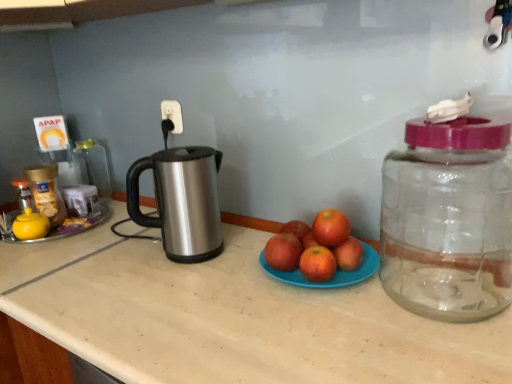
The height and width of the screenshot is (384, 512). What do you see at coordinates (181, 201) in the screenshot? I see `satin silver kettle at left` at bounding box center [181, 201].

In order to face orange matte grapefruit at center, the 1th grapefruit viewed from the top, should I rotate leftwards or rightwards?

To face it directly, rotate right by 9.881 degrees.

In order to click on red matte apple at center, which is the 2th apple from left to right in this screenshot , I will do `click(349, 254)`.

What do you see at coordinates (93, 165) in the screenshot? I see `transparent plastic bottle at left, the 1th bottle when ordered from back to front` at bounding box center [93, 165].

What do you see at coordinates (317, 264) in the screenshot? The width and height of the screenshot is (512, 384). I see `orange matte grapefruit at center, which is the second grapefruit in top-to-bottom order` at bounding box center [317, 264].

Describe the element at coordinates (448, 219) in the screenshot. I see `transparent plastic jar at right, which is the 3th bottle in back-to-front order` at that location.

In order to click on satin silver kettle at left in this screenshot , I will do `click(181, 201)`.

Considering the sizes of beige laminate countertop at center and gold plastic jar at left, the 2th bottle viewed from the back, in the image, is beige laminate countertop at center taller or shorter than gold plastic jar at left, the 2th bottle viewed from the back,?

Clearly, beige laminate countertop at center is taller compared to gold plastic jar at left, the 2th bottle viewed from the back.

Looking at this image, which point is more distant from viewer, (483, 343) or (56, 217)?

The point (56, 217) is farther from the camera.

Is beige laminate countertop at center at the right side of gold plastic jar at left, acting as the 2th bottle starting from the front?

Yes.

Would you say red matte apple at center, which is the 2th apple from left to right, is inside or outside satin silver kettle at left?

red matte apple at center, which is the 2th apple from left to right, is not enclosed by satin silver kettle at left.

Is red matte apple at center, which is the 2th apple from left to right, in front of or behind satin silver kettle at left in the image?

Clearly, red matte apple at center, which is the 2th apple from left to right, is in front of satin silver kettle at left.

Consider the image. Which point is more distant from viewer, (353, 265) or (138, 218)?

The point (138, 218) is more distant.

Visually, is red matte apple at center, acting as the first apple starting from the right, positioned to the left or to the right of satin silver kettle at left?

From the image, it's evident that red matte apple at center, acting as the first apple starting from the right, is to the right of satin silver kettle at left.

Considering the sizes of objects orange matte grapefruit at center, which ranks as the 1th grapefruit in bottom-to-top order, and transparent plastic bottle at left, acting as the second bottle starting from the right, in the image provided, who is smaller, orange matte grapefruit at center, which ranks as the 1th grapefruit in bottom-to-top order, or transparent plastic bottle at left, acting as the second bottle starting from the right,?

→ Smaller between the two is orange matte grapefruit at center, which ranks as the 1th grapefruit in bottom-to-top order.

Are orange matte grapefruit at center, which ranks as the 1th grapefruit in bottom-to-top order, and transparent plastic bottle at left, the 3th bottle viewed from the front, making contact?

No, orange matte grapefruit at center, which ranks as the 1th grapefruit in bottom-to-top order, is not in contact with transparent plastic bottle at left, the 3th bottle viewed from the front.

Based on the photo, in terms of height, does orange matte grapefruit at center, which is the second grapefruit in top-to-bottom order, look taller or shorter compared to transparent plastic bottle at left, which is the 2th bottle from left to right?

Clearly, orange matte grapefruit at center, which is the second grapefruit in top-to-bottom order, is shorter compared to transparent plastic bottle at left, which is the 2th bottle from left to right.

From the image's perspective, starting from the beige laminate countertop at center, which grapefruit is the 1st one above? Please provide its 2D coordinates.

[(317, 264)]

Considering the sizes of objects orange matte grapefruit at center, which is the second grapefruit in top-to-bottom order, and beige laminate countertop at center in the image provided, who is taller, orange matte grapefruit at center, which is the second grapefruit in top-to-bottom order, or beige laminate countertop at center?

Standing taller between the two is beige laminate countertop at center.

Does orange matte grapefruit at center, which ranks as the 1th grapefruit in bottom-to-top order, appear on the right side of beige laminate countertop at center?

Yes.

Looking at this image, is transparent plastic bottle at left, the 3th bottle viewed from the front, touching transparent plastic jar at right, which is the 3th bottle in back-to-front order?

No, transparent plastic bottle at left, the 3th bottle viewed from the front, is not with transparent plastic jar at right, which is the 3th bottle in back-to-front order.

Is transparent plastic bottle at left, the 1th bottle when ordered from back to front, facing away from transparent plastic jar at right, the first bottle positioned from the right?

No.

From the transparent plastic jar at right, the first bottle positioned from the right, count 2nd bottles backward and point to it. Please provide its 2D coordinates.

[(93, 165)]

From the image's perspective, is transparent plastic bottle at left, the 1th bottle when ordered from back to front, located beneath transparent plastic jar at right, which is the 3th bottle in back-to-front order?

No, from the image's perspective, transparent plastic bottle at left, the 1th bottle when ordered from back to front, is not below transparent plastic jar at right, which is the 3th bottle in back-to-front order.

Does point (236, 327) come behind point (450, 306)?

No.

Where is `countertop lying below the transparent plastic jar at right, which is the 3th bottle in back-to-front order (from the image's perspective)`? countertop lying below the transparent plastic jar at right, which is the 3th bottle in back-to-front order (from the image's perspective) is located at coordinates (232, 318).

Is beige laminate countertop at center positioned far away from transparent plastic jar at right, which is the third bottle in left-to-right order?

No, beige laminate countertop at center is not far from transparent plastic jar at right, which is the third bottle in left-to-right order.

The image size is (512, 384). Identify the location of bottle located below the gold plastic jar at left, the 2th bottle viewed from the back (from the image's perspective). (448, 219).

Can you confirm if gold plastic jar at left, the 3th bottle viewed from the right, is smaller than transparent plastic jar at right, which is the third bottle in left-to-right order?

Indeed, gold plastic jar at left, the 3th bottle viewed from the right, has a smaller size compared to transparent plastic jar at right, which is the third bottle in left-to-right order.

Is gold plastic jar at left, the 3th bottle viewed from the right, shorter than transparent plastic jar at right, the first bottle positioned from the right?

Indeed, gold plastic jar at left, the 3th bottle viewed from the right, has a lesser height compared to transparent plastic jar at right, the first bottle positioned from the right.

Is gold plastic jar at left, the 2th bottle viewed from the back, spatially inside transparent plastic jar at right, which is the 1th bottle from front to back, or outside of it?

gold plastic jar at left, the 2th bottle viewed from the back, lies outside transparent plastic jar at right, which is the 1th bottle from front to back.

From the beige laminate countertop at center, count 2nd bottles backward and point to it. Please provide its 2D coordinates.

[(46, 192)]

There is a satin silver kettle at left. Identify the location of the 2nd apple below it (from the image's perspective). (349, 254).

Which object lies nearer to the anchor point satin silver kettle at left, beige laminate countertop at center or transparent plastic jar at right, which is the third bottle in left-to-right order?

beige laminate countertop at center lies closer to satin silver kettle at left than the other object.

Based on their spatial positions, is orange matte grapefruit at center, which is counted as the 2th grapefruit, starting from the bottom, or red matte apple at center, which is the 2th apple from right to left, further from satin silver kettle at left?

orange matte grapefruit at center, which is counted as the 2th grapefruit, starting from the bottom, is positioned further to the anchor satin silver kettle at left.

Which object lies further to the anchor point satin silver kettle at left, orange matte grapefruit at center, which ranks as the 1th grapefruit in bottom-to-top order, or beige laminate countertop at center?

The object further to satin silver kettle at left is orange matte grapefruit at center, which ranks as the 1th grapefruit in bottom-to-top order.

Estimate the real-world distances between objects in this image. Which object is closer to gold plastic jar at left, the 3th bottle viewed from the right, transparent plastic jar at right, which is the 3th bottle in back-to-front order, or red matte apple at center, which is the 2th apple from right to left?

The object closer to gold plastic jar at left, the 3th bottle viewed from the right, is red matte apple at center, which is the 2th apple from right to left.

Based on their spatial positions, is transparent plastic bottle at left, the 1th bottle when ordered from back to front, or red matte apple at center, which is the 2th apple from left to right, closer to red matte apple at center, which is the first apple in left-to-right order?

Among the two, red matte apple at center, which is the 2th apple from left to right, is located nearer to red matte apple at center, which is the first apple in left-to-right order.

Which object lies nearer to the anchor point beige laminate countertop at center, transparent plastic bottle at left, which is the 2th bottle from left to right, or satin silver kettle at left?

Based on the image, satin silver kettle at left appears to be nearer to beige laminate countertop at center.

From the image, which object appears to be farther from satin silver kettle at left, beige laminate countertop at center or red matte apple at center, acting as the first apple starting from the right?

The object further to satin silver kettle at left is red matte apple at center, acting as the first apple starting from the right.

Considering their positions, is gold plastic jar at left, marked as the 1th bottle in a left-to-right arrangement, positioned further to satin silver kettle at left than red matte apple at center, which is the 2th apple from right to left?

gold plastic jar at left, marked as the 1th bottle in a left-to-right arrangement, lies further to satin silver kettle at left than the other object.

Image resolution: width=512 pixels, height=384 pixels. Find the location of `apple that lies between red matte apple at center, which is the 2th apple from right to left, and beige laminate countertop at center from top to bottom`. apple that lies between red matte apple at center, which is the 2th apple from right to left, and beige laminate countertop at center from top to bottom is located at coordinates (349, 254).

Image resolution: width=512 pixels, height=384 pixels. Find the location of `countertop between gold plastic jar at left, the 2th bottle viewed from the back, and orange matte grapefruit at center, which is the second grapefruit in top-to-bottom order, from left to right`. countertop between gold plastic jar at left, the 2th bottle viewed from the back, and orange matte grapefruit at center, which is the second grapefruit in top-to-bottom order, from left to right is located at coordinates (232, 318).

The width and height of the screenshot is (512, 384). I want to click on kettle between transparent plastic bottle at left, acting as the second bottle starting from the right, and red matte apple at center, which is the first apple in left-to-right order, in the horizontal direction, so click(x=181, y=201).

Locate an element on the screen. The height and width of the screenshot is (384, 512). kettle situated between transparent plastic bottle at left, acting as the second bottle starting from the right, and orange matte grapefruit at center, which is the second grapefruit in top-to-bottom order, from left to right is located at coordinates (181, 201).